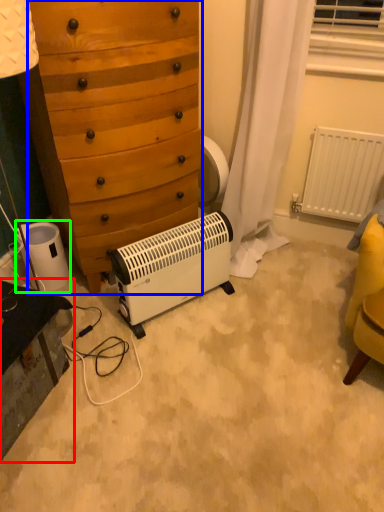
Question: Based on their relative distances, which object is nearer to vanity (highlighted by a red box)? Choose from chest of drawers (highlighted by a blue box) and appliance (highlighted by a green box).

Choices:
 (A) chest of drawers
 (B) appliance

Answer: (B)